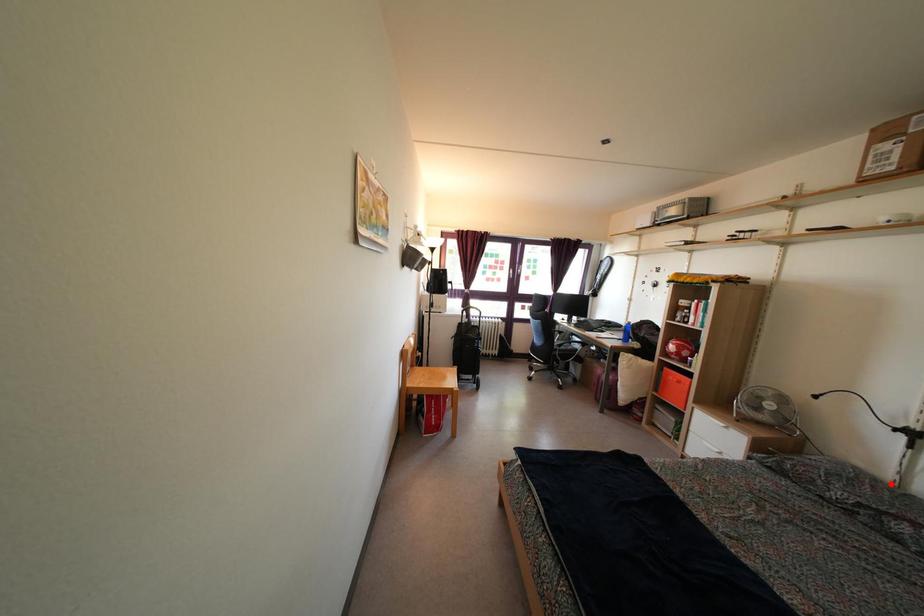
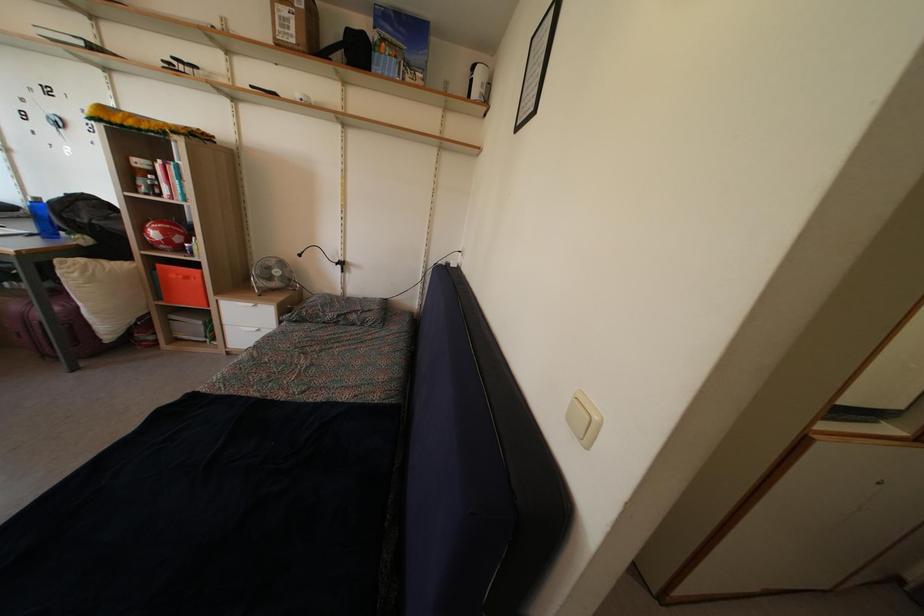
The point at the highlighted location is marked in the first image. Where is the corresponding point in the second image?

(342, 301)